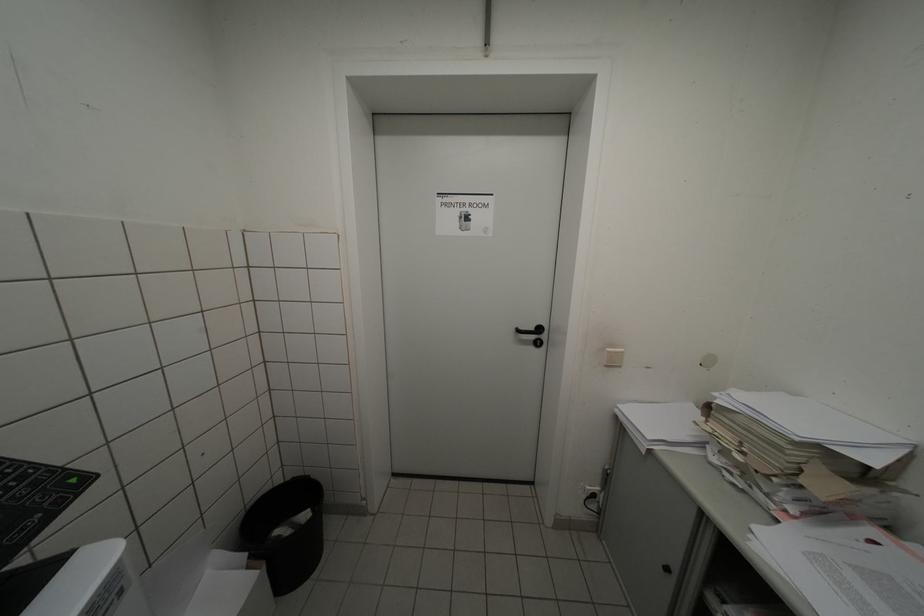
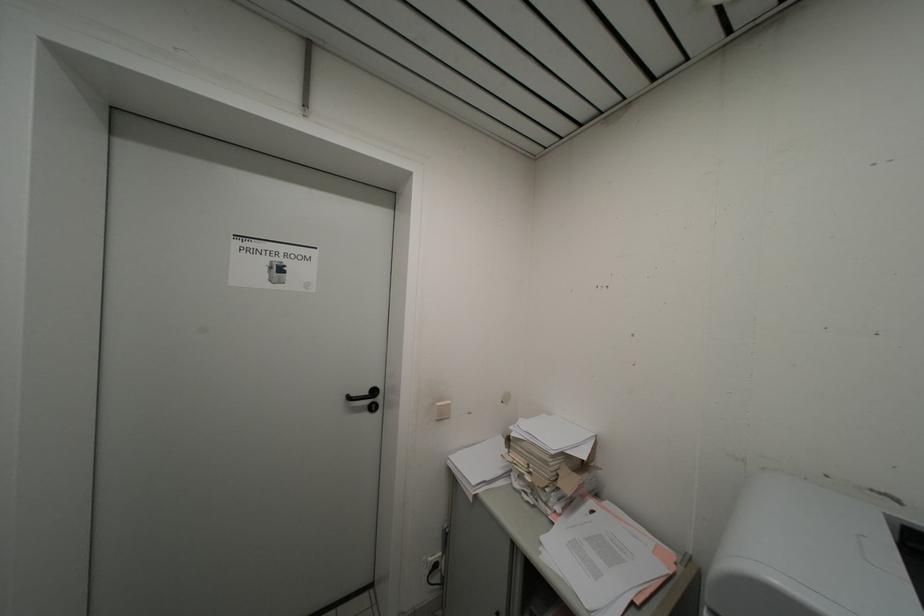
Question: Based on the continuous images, in which direction is the camera rotating? Reply with the corresponding letter.

Choices:
 (A) Left
 (B) Right
 (C) Up
 (D) Down

Answer: (B)